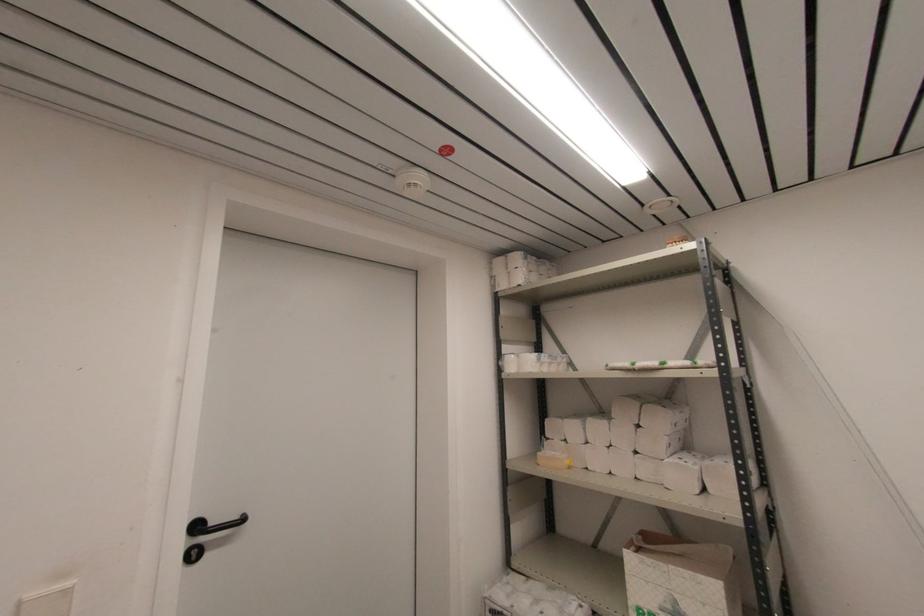
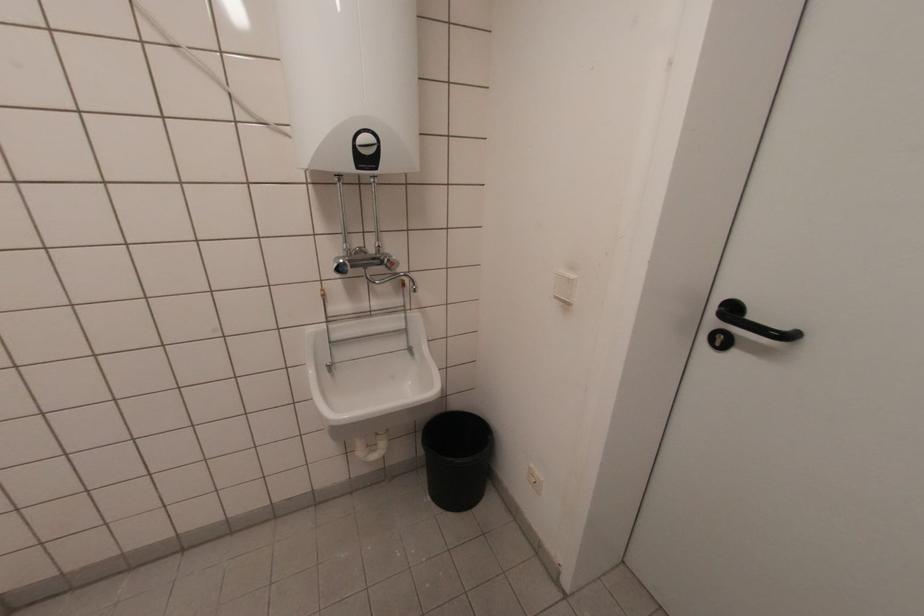
Find the pixel in the second image that matches pixel 73 583 in the first image.

(573, 277)